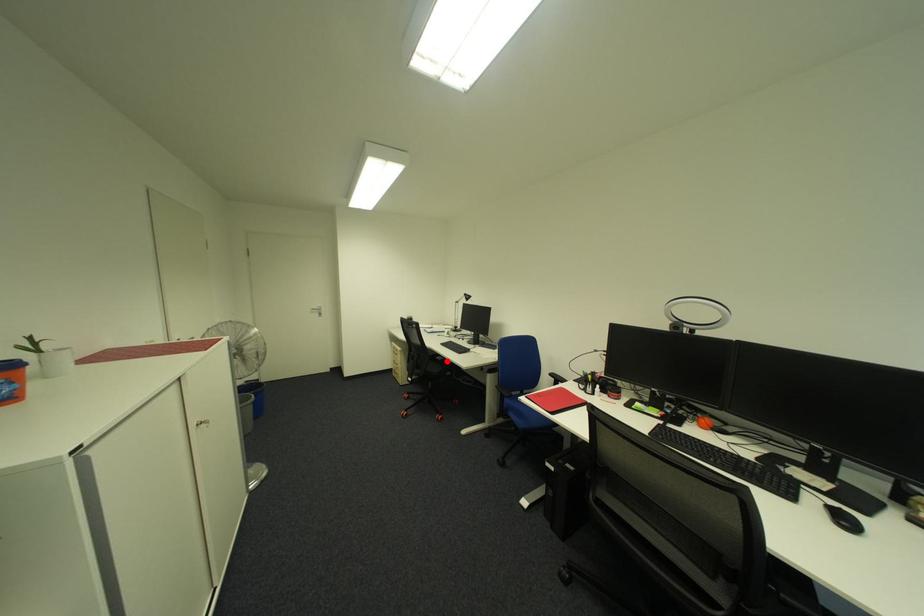
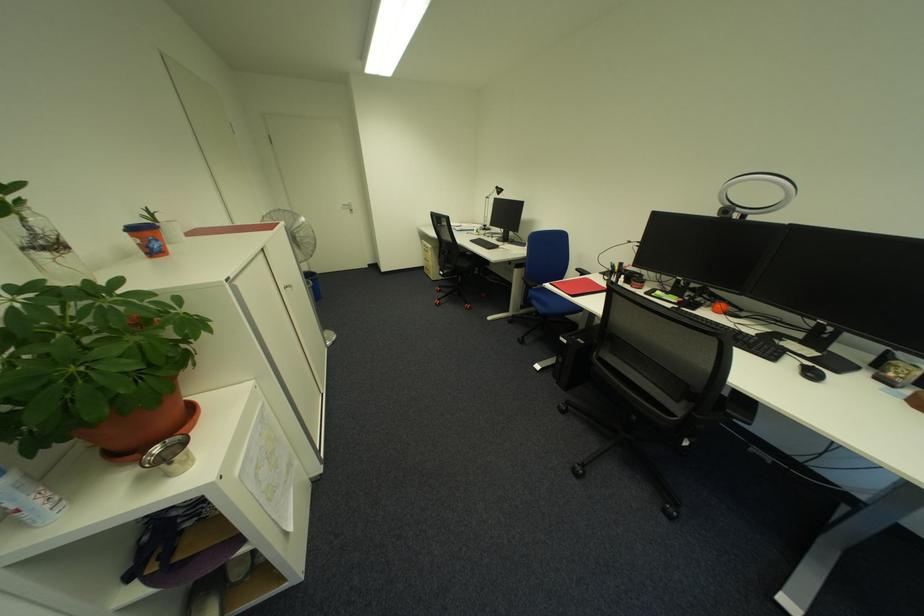
Question: I am providing you with two images of the same scene from different viewpoints. Image1 has a red point marked. In image2, the corresponding 3D location appears at what relative position? Reply with the corresponding letter.

Choices:
 (A) Closer
 (B) Farther

Answer: (A)